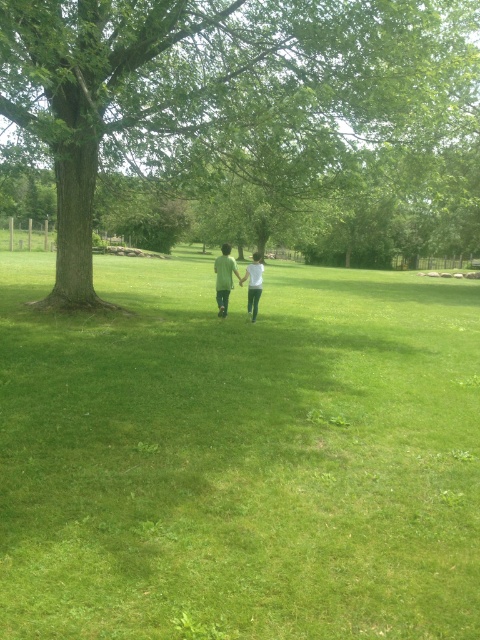
You are standing at the edge of the green grassy field at center and want to walk towards the matte green pants at center. Based on the scene, will you have to walk towards or away from the large tree with a thick trunk and wide canopy?

The green grassy field at center is in front of matte green pants at center, so to reach the matte green pants at center, you would need to walk away from the large tree with a thick trunk and wide canopy since the pants are further away from the tree compared to the field.

You are standing at the edge of the green grassy field at center and want to walk towards the green rough bark tree at center. Which direction should you walk to reach the tree?

The green rough bark tree at center is located at the center of the scene, so walking towards the center from the edge of the green grassy field at center will lead you directly to the tree.